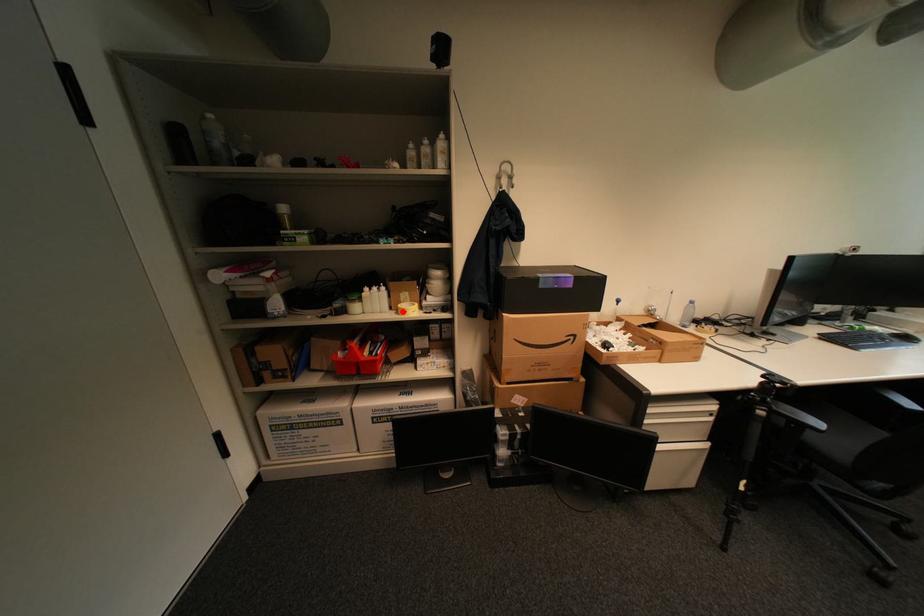
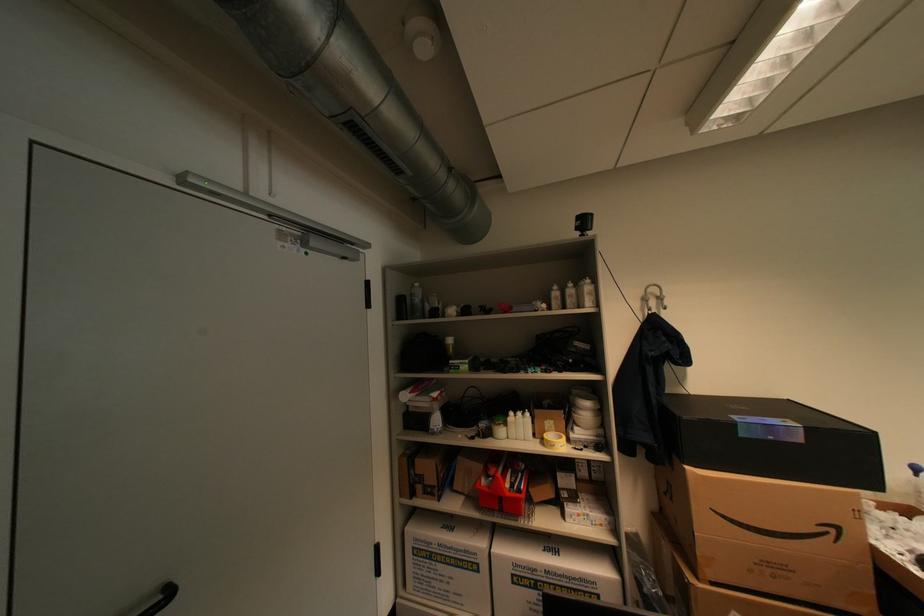
Question: A red point is marked in image1. In image2, is the corresponding 3D point closer to the camera or farther? Reply with the corresponding letter.

Choices:
 (A) The corresponding 3D point is closer.
 (B) The corresponding 3D point is farther.

Answer: (B)